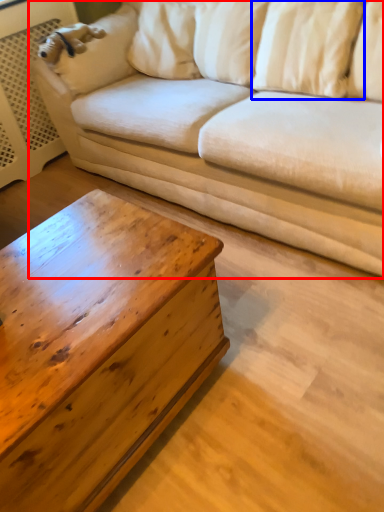
Question: Which of the following is the closest to the observer, studio couch (highlighted by a red box) or pillow (highlighted by a blue box)?

Choices:
 (A) studio couch
 (B) pillow

Answer: (A)